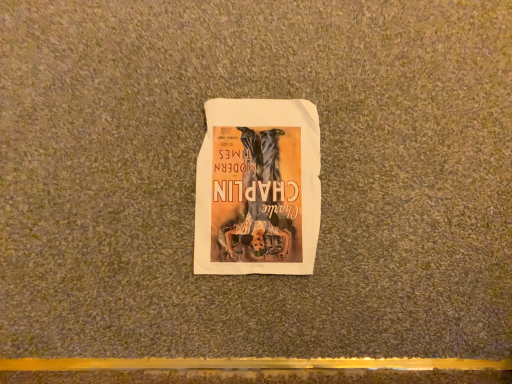
The height and width of the screenshot is (384, 512). Find the location of `free space above matte paper poster at center (from a real-world perspective)`. free space above matte paper poster at center (from a real-world perspective) is located at coordinates pos(256,184).